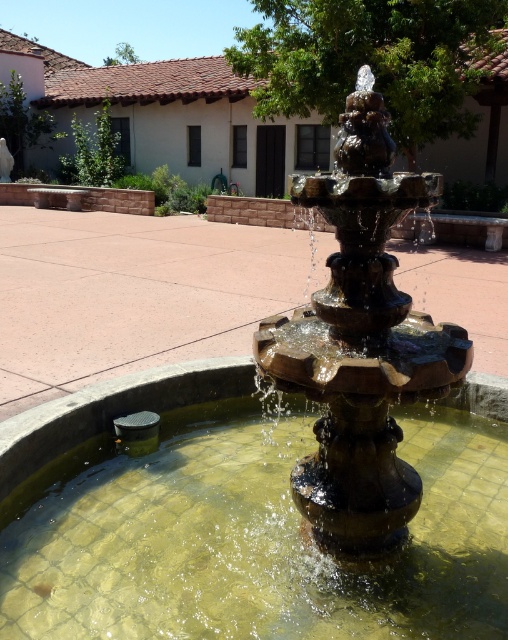
Question: Can you confirm if brown stone fountain at center is bigger than bronze fountain at center?

Choices:
 (A) no
 (B) yes

Answer: (A)

Question: Which point is farther to the camera?

Choices:
 (A) bronze fountain at center
 (B) brown stone fountain at center

Answer: (A)

Question: Which point appears farthest from the camera in this image?

Choices:
 (A) [x=489, y=465]
 (B) [x=490, y=323]

Answer: (B)

Question: Is brown stone fountain at center wider than bronze fountain at center?

Choices:
 (A) no
 (B) yes

Answer: (A)

Question: Is the position of brown stone fountain at center less distant than that of bronze fountain at center?

Choices:
 (A) yes
 (B) no

Answer: (A)